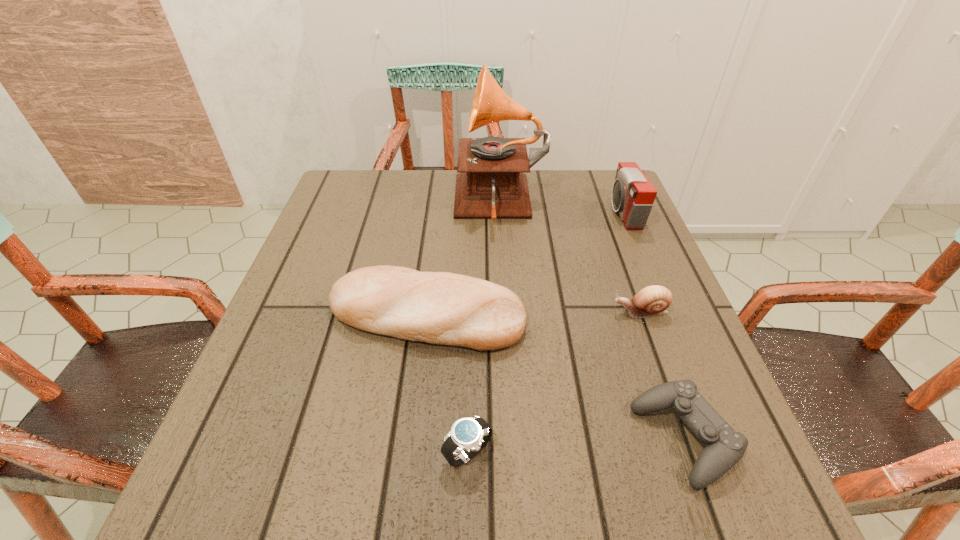
In order to click on free region located on the front-facing side of the fifth shortest object in this screenshot , I will do `click(480, 212)`.

Locate an element on the screen. vacant space located 0.390m on the front-facing side of the fifth shortest object is located at coordinates (461, 212).

The width and height of the screenshot is (960, 540). Identify the location of vacant area located 0.400m on the back of the third tallest object. (442, 185).

In order to click on free space located on the front of the watch in this screenshot , I will do `click(467, 510)`.

In order to click on free region located 0.290m on the front-facing side of the escargot in this screenshot , I will do `click(468, 312)`.

The height and width of the screenshot is (540, 960). I want to click on vacant space positioned 0.290m on the front-facing side of the escargot, so (x=468, y=312).

The height and width of the screenshot is (540, 960). I want to click on free space located on the front-facing side of the escargot, so click(x=583, y=312).

Locate an element on the screen. vacant point located 0.350m on the left of the control is located at coordinates 415,438.

Locate an element on the screen. The height and width of the screenshot is (540, 960). phonograph record that is at the far edge is located at coordinates (491, 184).

The height and width of the screenshot is (540, 960). Identify the location of camera that is at the far edge. (633, 195).